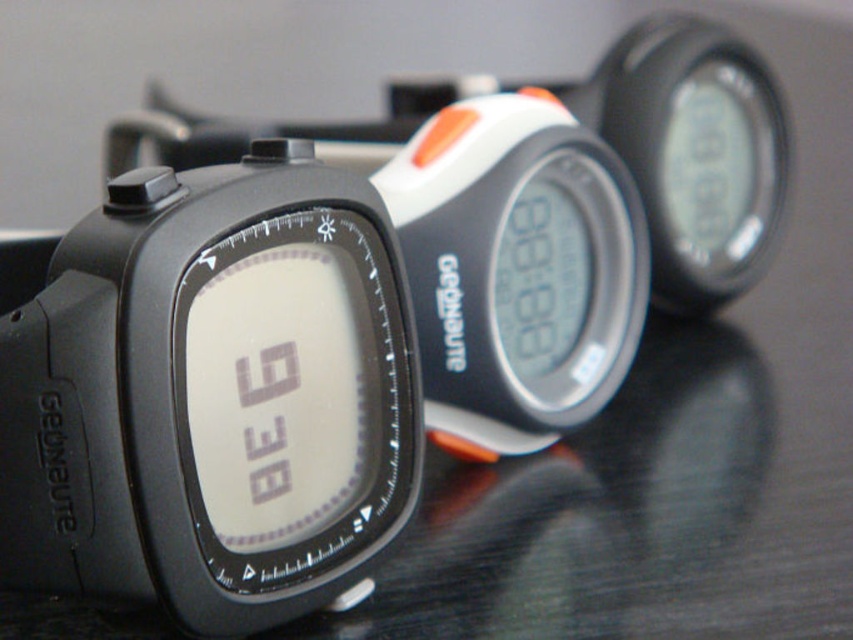
Question: Observing the image, what is the correct spatial positioning of black matte watch at center in reference to white plastic watch at center?

Choices:
 (A) above
 (B) below

Answer: (B)

Question: Can you confirm if black matte watch at center is wider than white plastic watch at center?

Choices:
 (A) yes
 (B) no

Answer: (A)

Question: Which object is closer to the camera taking this photo?

Choices:
 (A) white plastic watch at center
 (B) black matte watch at center

Answer: (B)

Question: Does black matte watch at center appear over white plastic watch at center?

Choices:
 (A) yes
 (B) no

Answer: (B)

Question: Which point appears farthest from the camera in this image?

Choices:
 (A) (257, 600)
 (B) (612, 241)

Answer: (B)